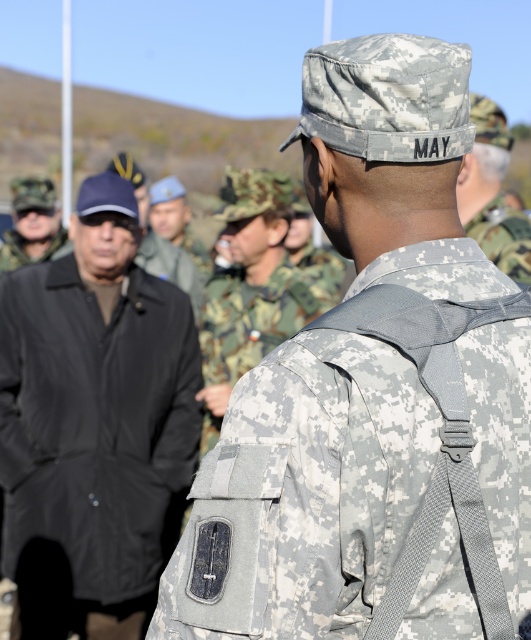
Can you confirm if matte black jacket at left is positioned above camouflage fabric uniform at center?

Yes.

Who is positioned more to the right, matte black jacket at left or camouflage fabric uniform at center?

matte black jacket at left

At what (x,y) coordinates should I click in order to perform the action: click on matte black jacket at left. Please return your answer as a coordinate pair (x, y). Looking at the image, I should click on (32, 225).

Can you confirm if digital camouflage uniform at center is taller than camouflage fabric uniform at center?

Yes.

Is point (321, 292) positioned before point (6, 243)?

That is True.

Find the location of a particular element. digital camouflage uniform at center is located at coordinates (253, 317).

Can you confirm if digital camouflage uniform at center is shorter than matte black jacket at left?

Incorrect, digital camouflage uniform at center's height does not fall short of matte black jacket at left's.

Who is lower down, digital camouflage uniform at center or matte black jacket at left?

digital camouflage uniform at center

The width and height of the screenshot is (531, 640). Describe the element at coordinates (253, 317) in the screenshot. I see `digital camouflage uniform at center` at that location.

Locate an element on the screen. This screenshot has height=640, width=531. digital camouflage uniform at center is located at coordinates (253, 317).